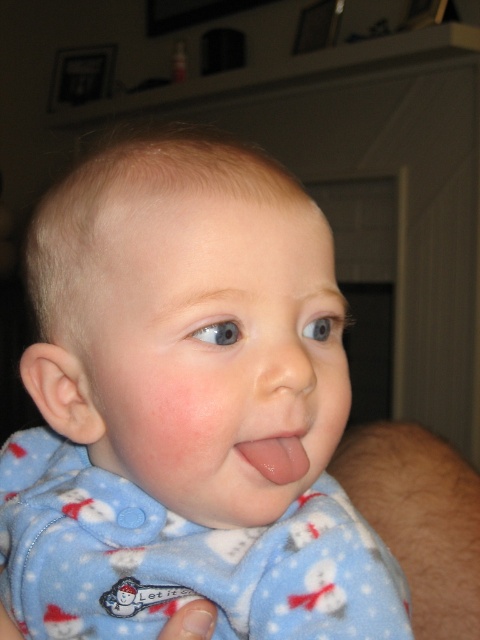
Question: Does smooth flesh nose at center appear over glossy pink tongue at center?

Choices:
 (A) no
 (B) yes

Answer: (B)

Question: Is blue fleece pajamas at center behind smooth flesh nose at center?

Choices:
 (A) yes
 (B) no

Answer: (B)

Question: Which of the following is the farthest from the observer?

Choices:
 (A) (288, 456)
 (B) (312, 348)
 (C) (56, 596)

Answer: (C)

Question: Does smooth flesh nose at center have a lesser width compared to glossy pink tongue at center?

Choices:
 (A) no
 (B) yes

Answer: (A)

Question: Which of the following is the closest to the observer?

Choices:
 (A) (191, 164)
 (B) (276, 365)
 (C) (255, 452)

Answer: (B)

Question: Which point is closer to the camera?

Choices:
 (A) glossy pink tongue at center
 (B) smooth flesh nose at center
 (C) blue fleece pajamas at center

Answer: (C)